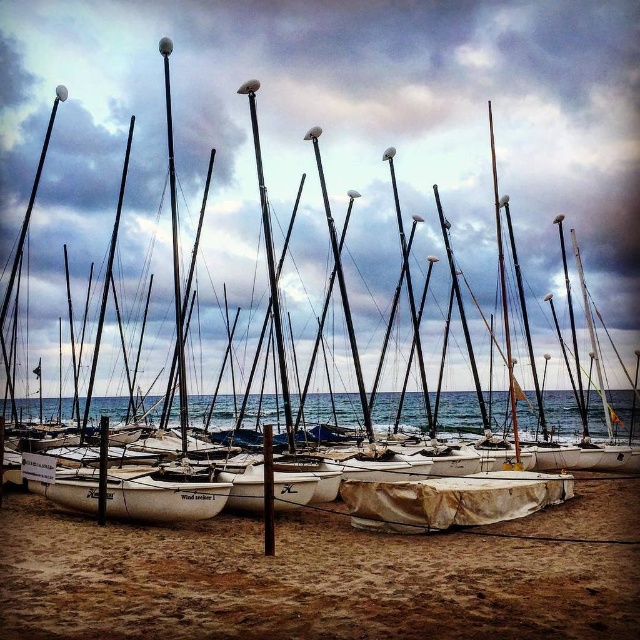
You are standing on the beach and see the blue water at center and the white matte sailboat at center. Which one appears taller from your perspective?

The blue water at center appears taller than the white matte sailboat at center because the description states that the blue water at center is much taller as white matte sailboat at center.

You are standing on the beach looking at the sailboats. There are two points marked in the scene. The first point is at coordinates point (344, 424) and the second is at point (160, 497). Which point is closer to you?

Point (344, 424) is closer to you because it is further to the viewer than point (160, 497).

You are a beach maintenance worker who needs to cover the white matte sailboat at center with a tarp. You have a white tarpaulin at center available. Based on their widths, will the tarpaulin be sufficient to cover the sailboat?

The white tarpaulin at center is wider than the white matte sailboat at center, so it can sufficiently cover the sailboat.